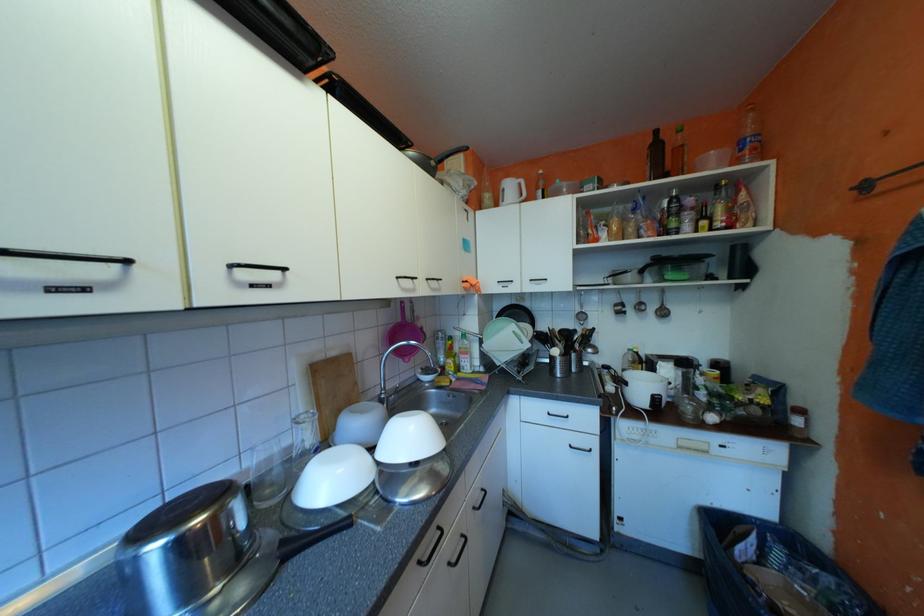
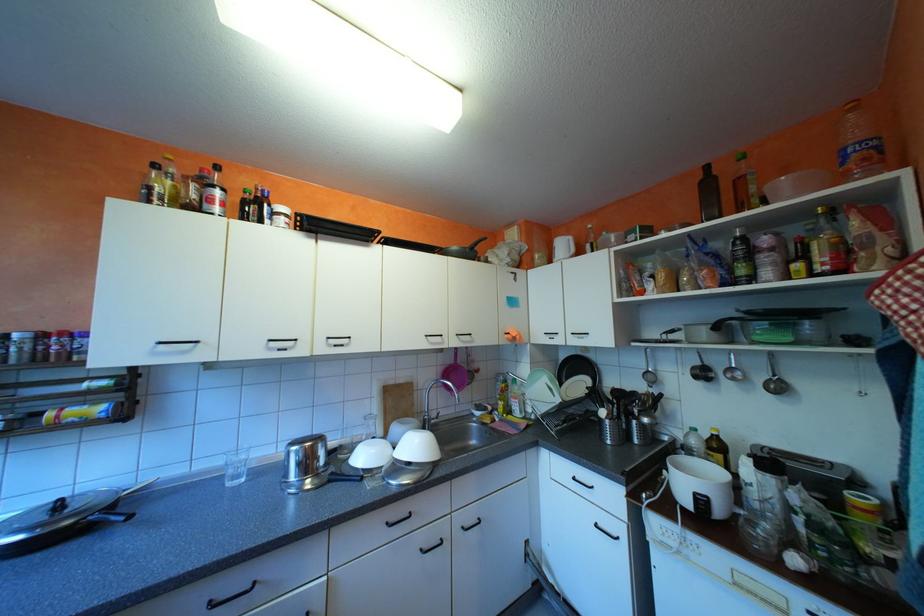
Where in the second image is the point corresponding to (460,562) from the first image?

(432, 549)